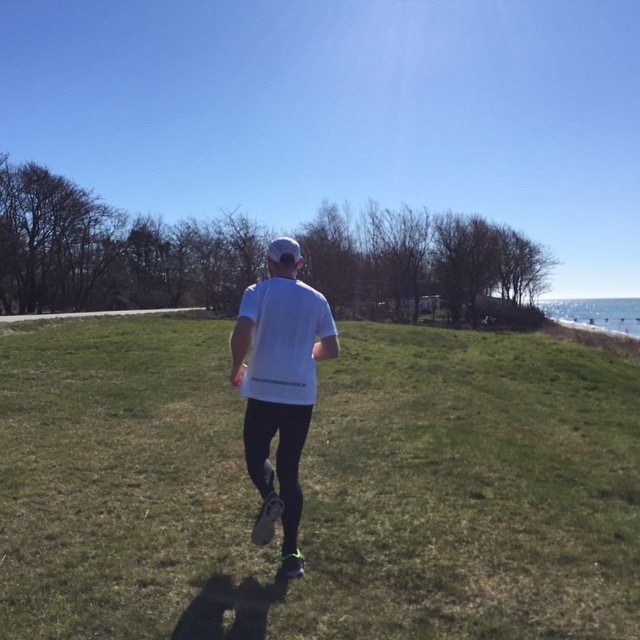
Does green grass at center appear over white matte t-shirt at center?

Actually, green grass at center is below white matte t-shirt at center.

This screenshot has width=640, height=640. Identify the location of green grass at center. (317, 486).